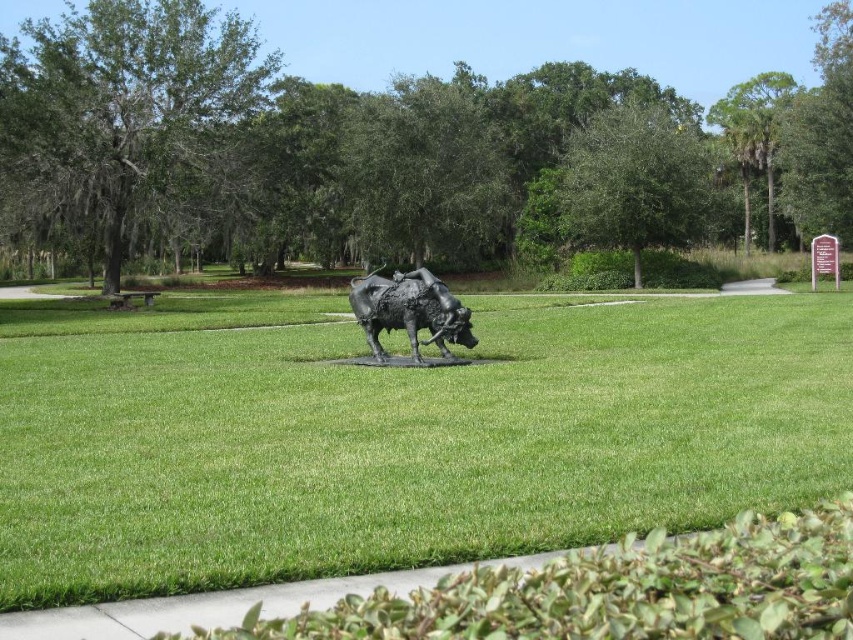
Question: Among these objects, which one is farthest from the camera?

Choices:
 (A) bronze statue at center
 (B) green grass at center

Answer: (A)

Question: Is green grass at center bigger than bronze statue at center?

Choices:
 (A) yes
 (B) no

Answer: (B)

Question: Does green grass at center appear under bronze statue at center?

Choices:
 (A) no
 (B) yes

Answer: (B)

Question: Is green grass at center bigger than bronze statue at center?

Choices:
 (A) yes
 (B) no

Answer: (B)